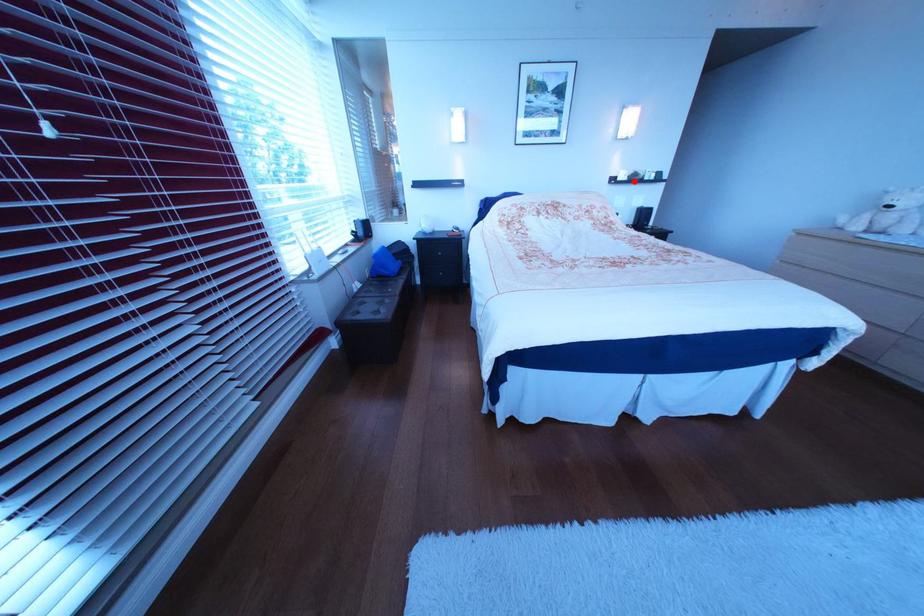
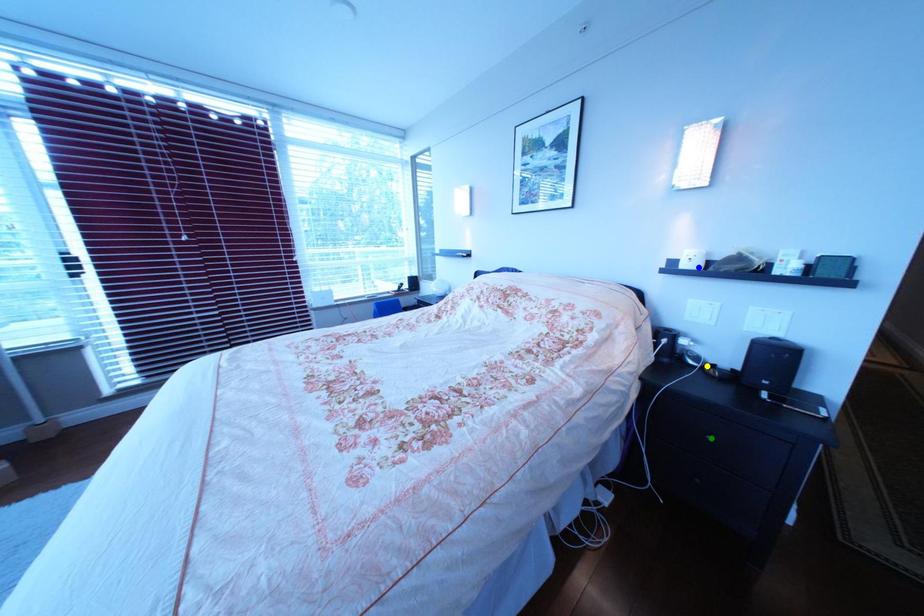
Question: I am providing you with two images of the same scene from different viewpoints. A red point is marked on the first image. You are given multiple points on the second image. Which point in image 2 is actually the same real-world point as the red point in image 1?

Choices:
 (A) green point
 (B) yellow point
 (C) blue point

Answer: (C)